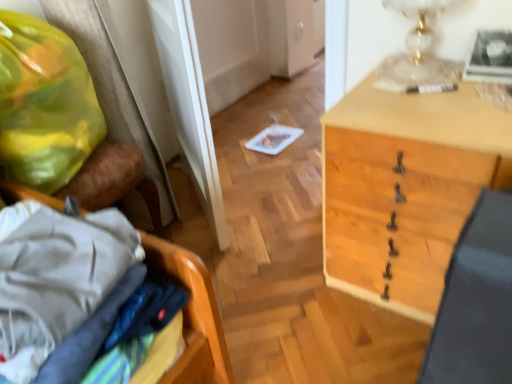
Question: Is white glass table lamp at upper right oriented towards yellow plastic bag at left?

Choices:
 (A) yes
 (B) no

Answer: (B)

Question: From the image's perspective, would you say white glass table lamp at upper right is shown under yellow plastic bag at left?

Choices:
 (A) no
 (B) yes

Answer: (A)

Question: Is white glass table lamp at upper right positioned with its back to yellow plastic bag at left?

Choices:
 (A) no
 (B) yes

Answer: (A)

Question: Is yellow plastic bag at left surrounded by white glass table lamp at upper right?

Choices:
 (A) no
 (B) yes

Answer: (A)

Question: Is white glass table lamp at upper right in front of yellow plastic bag at left?

Choices:
 (A) yes
 (B) no

Answer: (B)

Question: Do you think wooden laundry basket at left is within black leather swivel chair at lower right, or outside of it?

Choices:
 (A) outside
 (B) inside

Answer: (A)

Question: Considering the positions of point (193, 269) and point (478, 345), is point (193, 269) closer or farther from the camera than point (478, 345)?

Choices:
 (A) closer
 (B) farther

Answer: (B)

Question: Considering the positions of wooden laundry basket at left and black leather swivel chair at lower right in the image, is wooden laundry basket at left wider or thinner than black leather swivel chair at lower right?

Choices:
 (A) wide
 (B) thin

Answer: (A)

Question: From the image's perspective, is wooden laundry basket at left positioned above or below black leather swivel chair at lower right?

Choices:
 (A) above
 (B) below

Answer: (A)

Question: Do you think wooden desk at center is within yellow plastic bag at left, or outside of it?

Choices:
 (A) outside
 (B) inside

Answer: (A)

Question: In terms of width, does wooden desk at center look wider or thinner when compared to yellow plastic bag at left?

Choices:
 (A) wide
 (B) thin

Answer: (A)

Question: In the image, is wooden desk at center on the left side or the right side of yellow plastic bag at left?

Choices:
 (A) right
 (B) left

Answer: (A)

Question: From the image's perspective, is wooden desk at center positioned above or below yellow plastic bag at left?

Choices:
 (A) below
 (B) above

Answer: (A)

Question: Considering the positions of white glass table lamp at upper right and yellow plastic bag at left in the image, is white glass table lamp at upper right bigger or smaller than yellow plastic bag at left?

Choices:
 (A) big
 (B) small

Answer: (B)

Question: Considering the relative positions of white glass table lamp at upper right and yellow plastic bag at left in the image provided, is white glass table lamp at upper right to the left or to the right of yellow plastic bag at left?

Choices:
 (A) left
 (B) right

Answer: (B)